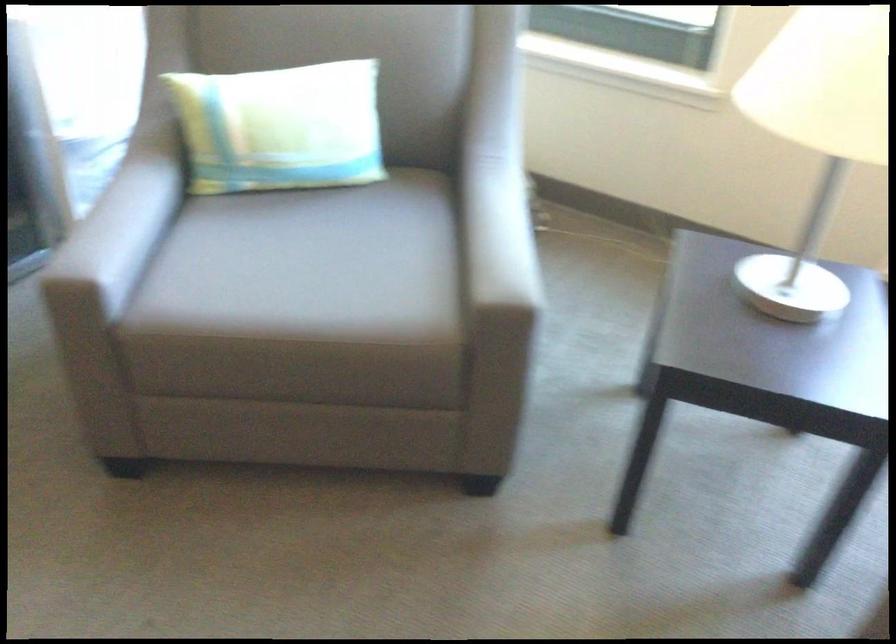
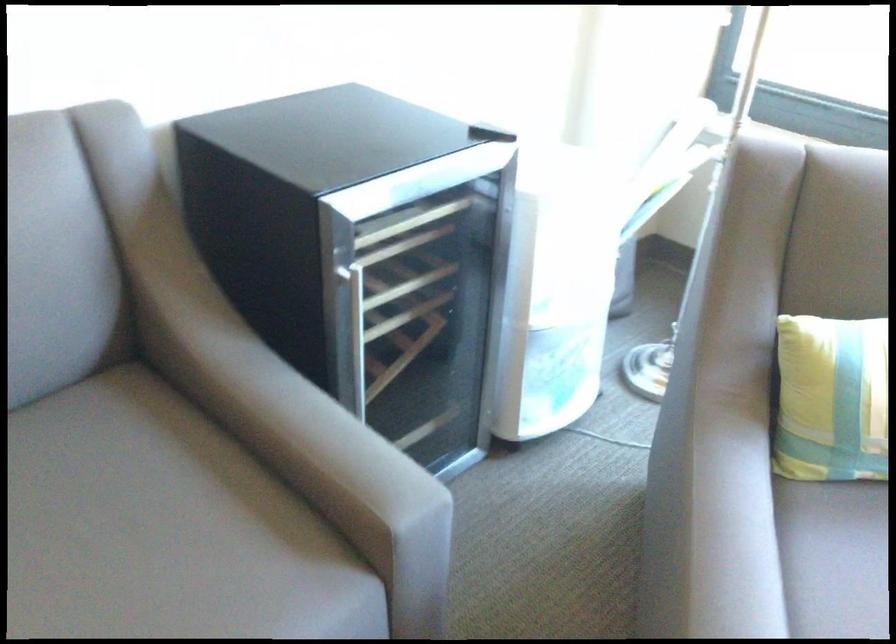
Where in the second image is the point corresponding to (202,228) from the first image?

(837, 553)